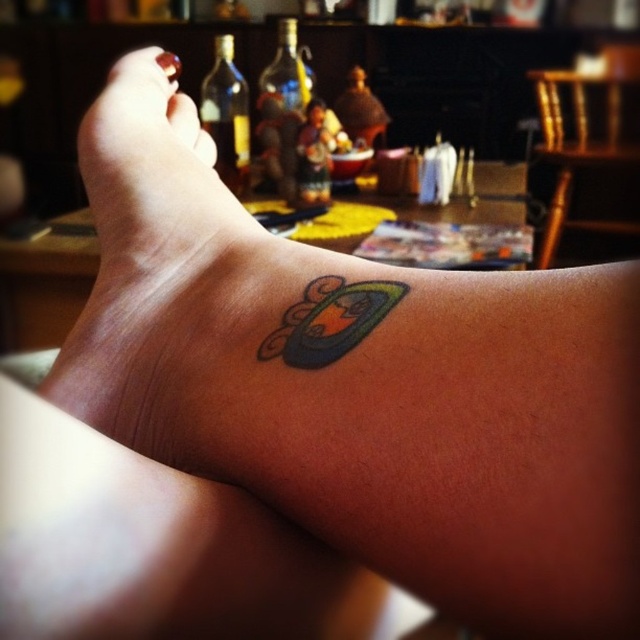
Question: Is multicolored glossy tattoo at lower center to the right of matte skin toe at upper left from the viewer's perspective?

Choices:
 (A) yes
 (B) no

Answer: (A)

Question: Does multicolored glossy tattoo at lower center appear under transparent glass bottle at center?

Choices:
 (A) no
 (B) yes

Answer: (B)

Question: Estimate the real-world distances between objects in this image. Which object is farther from the multicolored glossy tattoo at lower center?

Choices:
 (A) transparent glass bottle at center
 (B) matte skin toe at upper left
 (C) translucent glass bottle at center
 (D) white matte toe at upper left

Answer: (C)

Question: Can you confirm if multicolored glossy tattoo at lower center is thinner than matte skin toe at upper left?

Choices:
 (A) no
 (B) yes

Answer: (B)

Question: Which of the following is the closest to the observer?

Choices:
 (A) translucent glass bottle at center
 (B) multicolored glossy tattoo at lower center
 (C) matte skin toe at upper left

Answer: (B)

Question: Which point is closer to the camera taking this photo?

Choices:
 (A) (244, 122)
 (B) (262, 152)
 (C) (166, 60)
 (D) (348, 333)

Answer: (D)